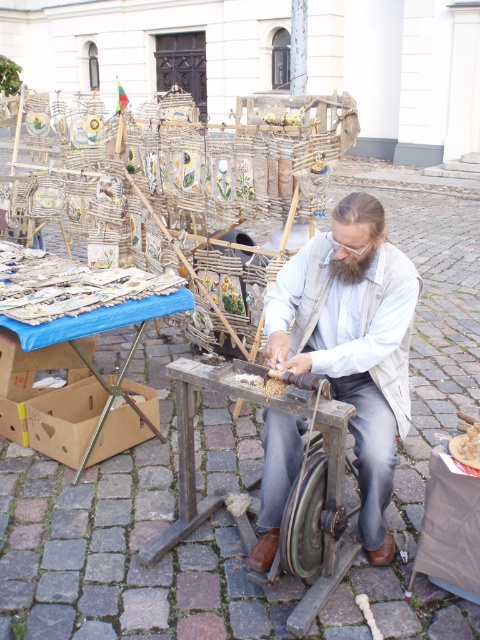
Question: Can you confirm if white cotton shirt at center is positioned below green rubber wheel at center?

Choices:
 (A) yes
 (B) no

Answer: (B)

Question: Is white cotton shirt at center behind green rubber wheel at center?

Choices:
 (A) yes
 (B) no

Answer: (A)

Question: Can you confirm if white cotton shirt at center is positioned above green rubber wheel at center?

Choices:
 (A) no
 (B) yes

Answer: (B)

Question: Among these points, which one is nearest to the camera?

Choices:
 (A) (385, 529)
 (B) (294, 545)

Answer: (B)